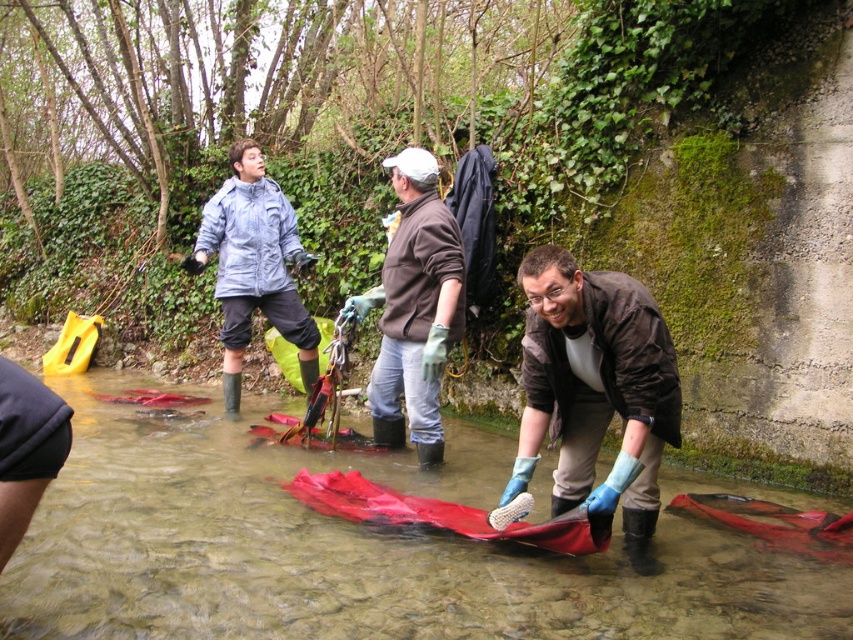
Which of these two, brown fuzzy sweater at center or light blue waterproof jacket at left, stands shorter?

With less height is brown fuzzy sweater at center.

This screenshot has height=640, width=853. What do you see at coordinates (415, 308) in the screenshot? I see `brown fuzzy sweater at center` at bounding box center [415, 308].

Identify the location of brown fuzzy sweater at center. This screenshot has width=853, height=640. (415, 308).

Where is `brown fuzzy sweater at center`? brown fuzzy sweater at center is located at coordinates (415, 308).

Who is shorter, red fabric at center or blue rubber gloves at center?

red fabric at center is shorter.

Which is in front, point (720, 580) or point (577, 352)?

Point (577, 352) is more forward.

The width and height of the screenshot is (853, 640). In order to click on red fabric at center in this screenshot , I will do `click(352, 550)`.

Who is positioned more to the left, red fabric at center or light blue waterproof jacket at left?

light blue waterproof jacket at left

Can you confirm if red fabric at center is taller than light blue waterproof jacket at left?

No.

Locate an element on the screen. Image resolution: width=853 pixels, height=640 pixels. red fabric at center is located at coordinates (352, 550).

This screenshot has width=853, height=640. Find the location of `red fabric at center`. red fabric at center is located at coordinates (352, 550).